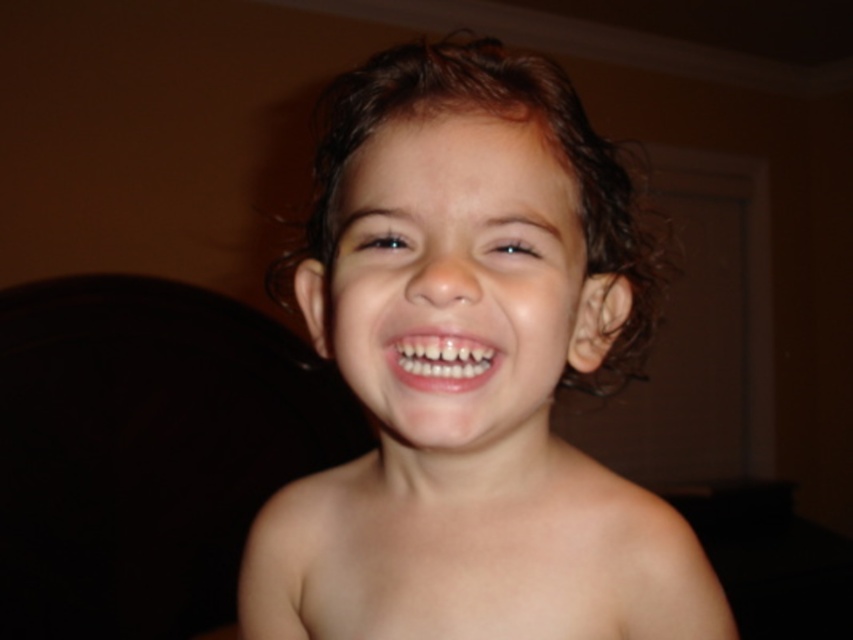
From the picture: Measure the distance between smooth skin child at center and camera.

smooth skin child at center and camera are 11.57 inches apart from each other.

Is smooth skin child at center behind skin at center?

No, it is not.

Which is behind, point (473, 433) or point (408, 467)?

Point (408, 467)

Locate an element on the screen. The image size is (853, 640). smooth skin child at center is located at coordinates (480, 385).

In the scene shown: Between skin at center and white glossy teeth at center, which one is positioned lower?

skin at center

Which is more to the left, skin at center or white glossy teeth at center?

skin at center is more to the left.

Image resolution: width=853 pixels, height=640 pixels. In order to click on skin at center in this screenshot , I will do (474, 548).

Locate an element on the screen. This screenshot has height=640, width=853. skin at center is located at coordinates (474, 548).

Is point (543, 193) less distant than point (473, 369)?

No, it is not.

Which is above, smooth skin child at center or white glossy teeth at center?

smooth skin child at center

Which is in front, point (416, 60) or point (465, 337)?

Point (465, 337)

Identify the location of smooth skin child at center. The height and width of the screenshot is (640, 853). (480, 385).